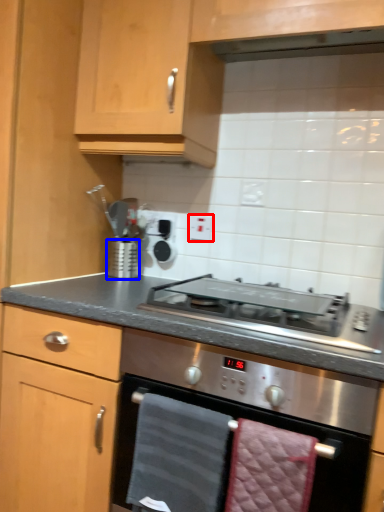
Question: Among these objects, which one is farthest to the camera, electric outlet (highlighted by a red box) or kitchen appliance (highlighted by a blue box)?

Choices:
 (A) electric outlet
 (B) kitchen appliance

Answer: (A)